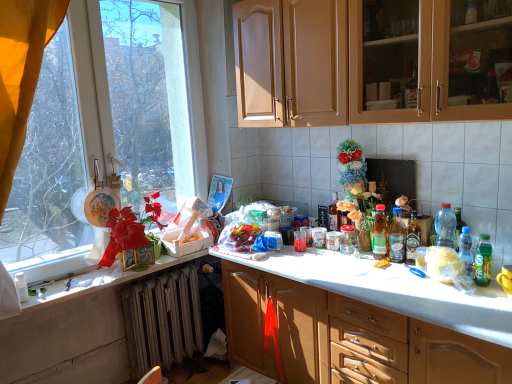
Where is `free space to the left of translucent glass bottle at center, the 5th bottle in the front-to-back sequence`? free space to the left of translucent glass bottle at center, the 5th bottle in the front-to-back sequence is located at coordinates (362, 254).